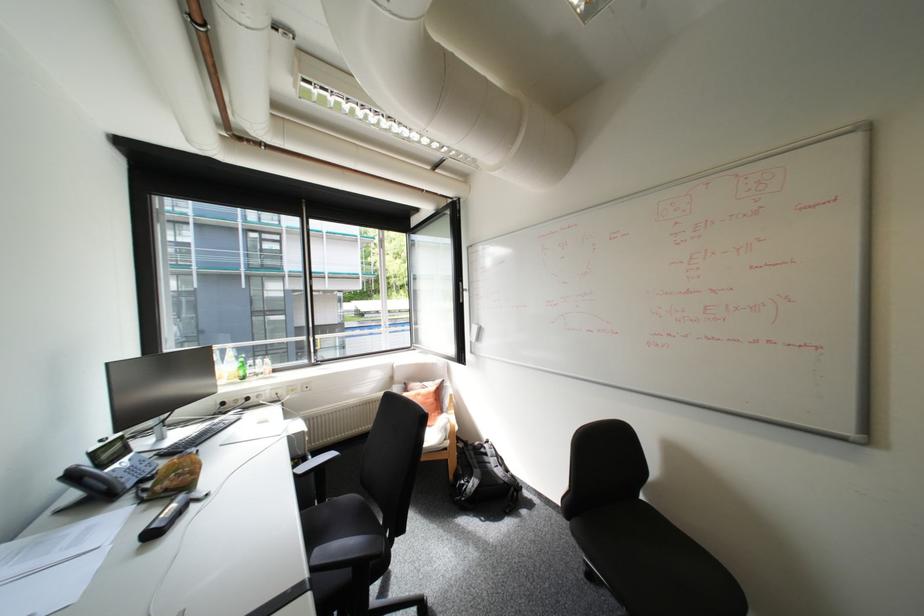
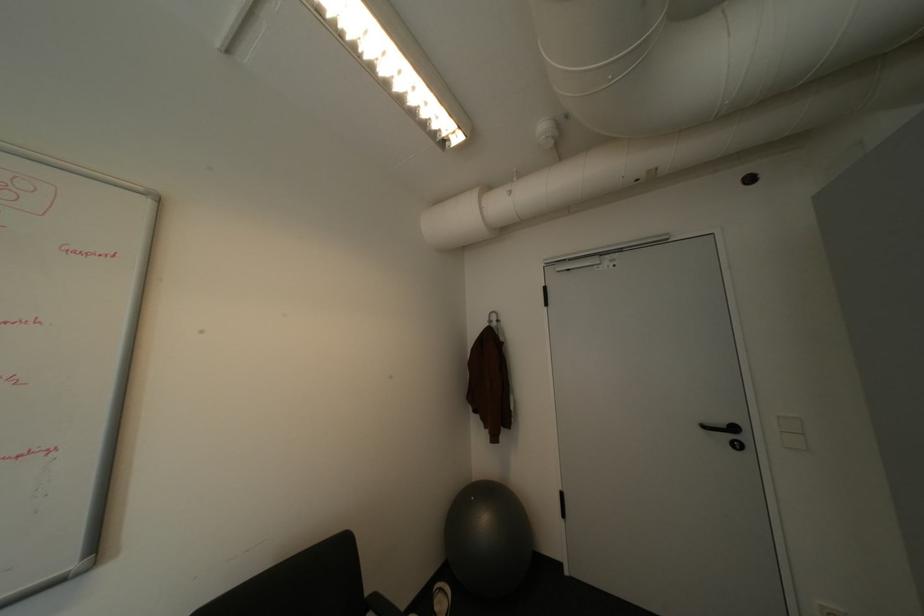
Question: The camera is either moving clockwise (left) or counter-clockwise (right) around the object. The first image is from the beginning of the video and the second image is from the end. Is the camera moving left or right when shooting the video?

Choices:
 (A) Left
 (B) Right

Answer: (A)